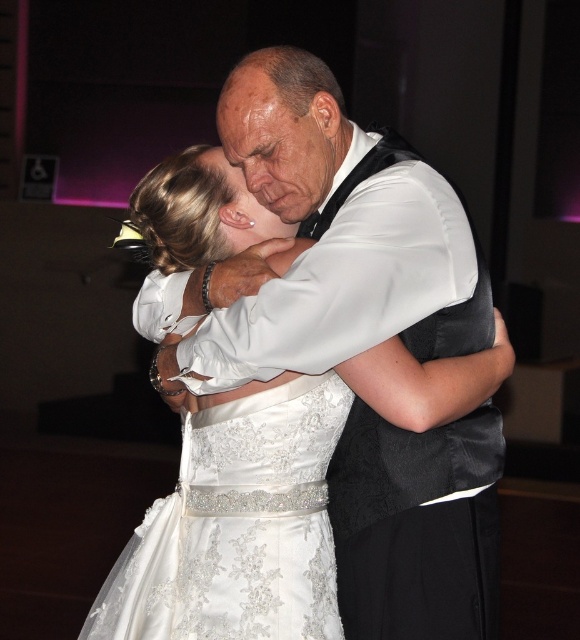
Consider the image. Is white satin dress at center positioned before satin/embroidered wedding dress at center?

Yes, white satin dress at center is in front of satin/embroidered wedding dress at center.

Who is lower down, white satin dress at center or satin/embroidered wedding dress at center?

satin/embroidered wedding dress at center is lower down.

Which is in front, point (164, 605) or point (153, 554)?

Point (164, 605) is more forward.

You are a GUI agent. You are given a task and a screenshot of the screen. Output one action in this format:
    pyautogui.click(x=<x>, y=<y>)
    Task: Click on the white satin dress at center
    The width and height of the screenshot is (580, 640).
    Given the screenshot: What is the action you would take?
    pyautogui.click(x=269, y=499)